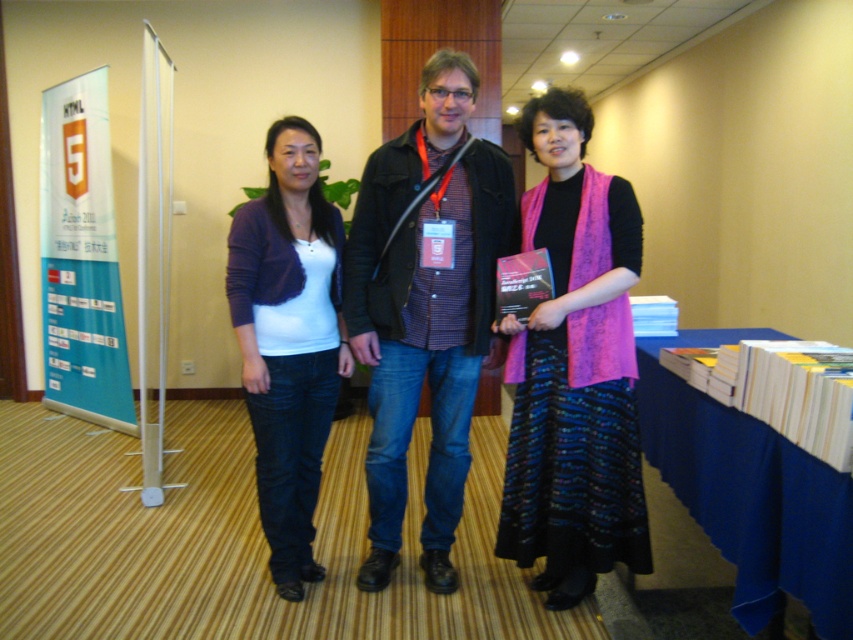
Can you confirm if pink knitted scarf at center is positioned below matte purple cardigan at center?

No, pink knitted scarf at center is not below matte purple cardigan at center.

How much distance is there between pink knitted scarf at center and matte purple cardigan at center?

pink knitted scarf at center and matte purple cardigan at center are 70.35 centimeters apart from each other.

At what (x,y) coordinates should I click in order to perform the action: click on pink knitted scarf at center. Please return your answer as a coordinate pair (x, y). Looking at the image, I should click on (573, 369).

Who is taller, matte black jacket at center or blue fabric table at lower right?

Standing taller between the two is matte black jacket at center.

Does matte black jacket at center appear on the left side of blue fabric table at lower right?

Indeed, matte black jacket at center is positioned on the left side of blue fabric table at lower right.

Is point (439, 522) in front of point (680, 440)?

No, it is behind (680, 440).

At what (x,y) coordinates should I click in order to perform the action: click on matte black jacket at center. Please return your answer as a coordinate pair (x, y). Looking at the image, I should click on click(425, 307).

Is pink knitted scarf at center in front of blue fabric table at lower right?

No.

In the scene shown: Which is below, pink knitted scarf at center or blue fabric table at lower right?

blue fabric table at lower right

Is point (607, 486) in front of point (814, 563)?

No, (607, 486) is behind (814, 563).

The width and height of the screenshot is (853, 640). Find the location of `pink knitted scarf at center`. pink knitted scarf at center is located at coordinates (573, 369).